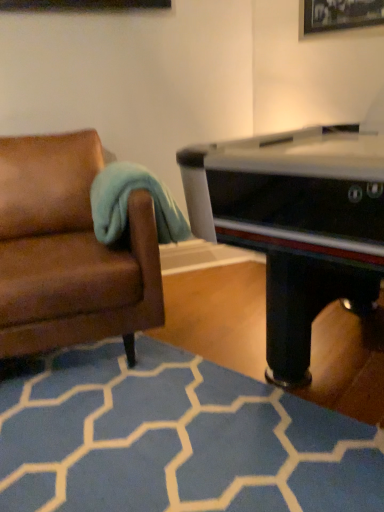
Question: Is blue carpet at lower center touching brown leather couch at left?

Choices:
 (A) no
 (B) yes

Answer: (A)

Question: From a real-world perspective, is blue carpet at lower center below brown leather couch at left?

Choices:
 (A) yes
 (B) no

Answer: (A)

Question: Is blue carpet at lower center far away from brown leather couch at left?

Choices:
 (A) yes
 (B) no

Answer: (B)

Question: Would you say blue carpet at lower center is outside brown leather couch at left?

Choices:
 (A) no
 (B) yes

Answer: (B)

Question: Can you confirm if blue carpet at lower center is positioned to the left of brown leather couch at left?

Choices:
 (A) no
 (B) yes

Answer: (A)

Question: In the image, is teal soft fabric at left positioned in front of or behind brown leather couch at left?

Choices:
 (A) front
 (B) behind

Answer: (B)

Question: From the image's perspective, is teal soft fabric at left above or below brown leather couch at left?

Choices:
 (A) below
 (B) above

Answer: (B)

Question: Considering the positions of point (119, 226) and point (127, 342), is point (119, 226) closer or farther from the camera than point (127, 342)?

Choices:
 (A) farther
 (B) closer

Answer: (B)

Question: Considering the positions of teal soft fabric at left and brown leather couch at left in the image, is teal soft fabric at left taller or shorter than brown leather couch at left?

Choices:
 (A) tall
 (B) short

Answer: (B)

Question: Considering their positions, is blue carpet at lower center located in front of or behind brown leather couch at left?

Choices:
 (A) front
 (B) behind

Answer: (A)

Question: Looking at the image, does blue carpet at lower center seem bigger or smaller compared to brown leather couch at left?

Choices:
 (A) small
 (B) big

Answer: (A)

Question: From the image's perspective, is blue carpet at lower center located above or below brown leather couch at left?

Choices:
 (A) below
 (B) above

Answer: (A)

Question: Is point (147, 477) positioned closer to the camera than point (14, 337)?

Choices:
 (A) closer
 (B) farther

Answer: (A)

Question: Is teal soft fabric at left to the left or to the right of blue carpet at lower center in the image?

Choices:
 (A) right
 (B) left

Answer: (B)

Question: Choose the correct answer: Is teal soft fabric at left inside blue carpet at lower center or outside it?

Choices:
 (A) outside
 (B) inside

Answer: (A)